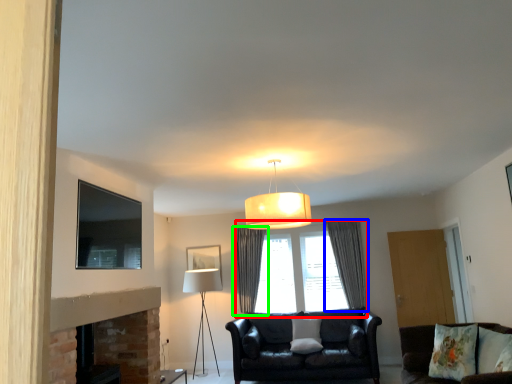
Question: Based on their relative distances, which object is nearer to window (highlighted by a red box)? Choose from curtain (highlighted by a blue box) and curtain (highlighted by a green box).

Choices:
 (A) curtain
 (B) curtain

Answer: (A)